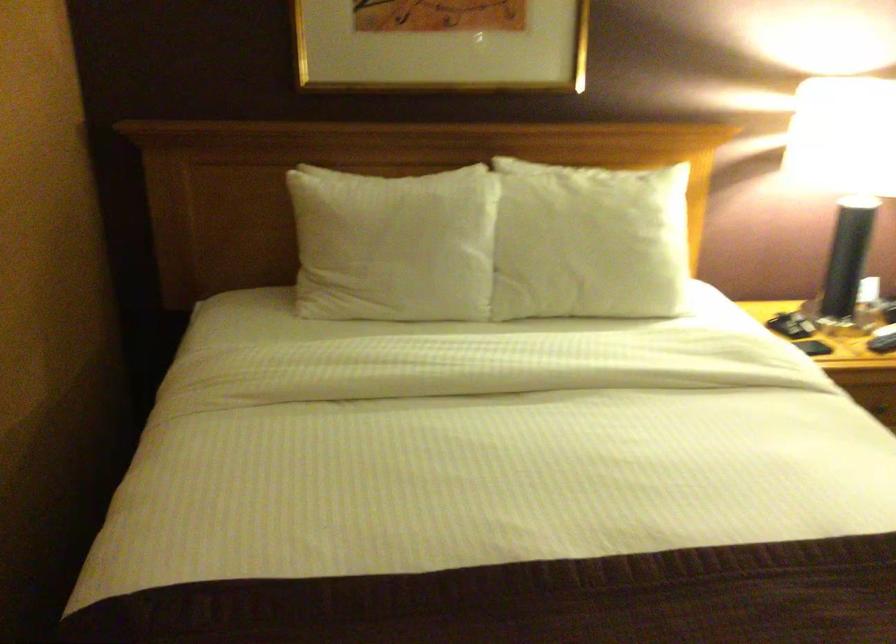
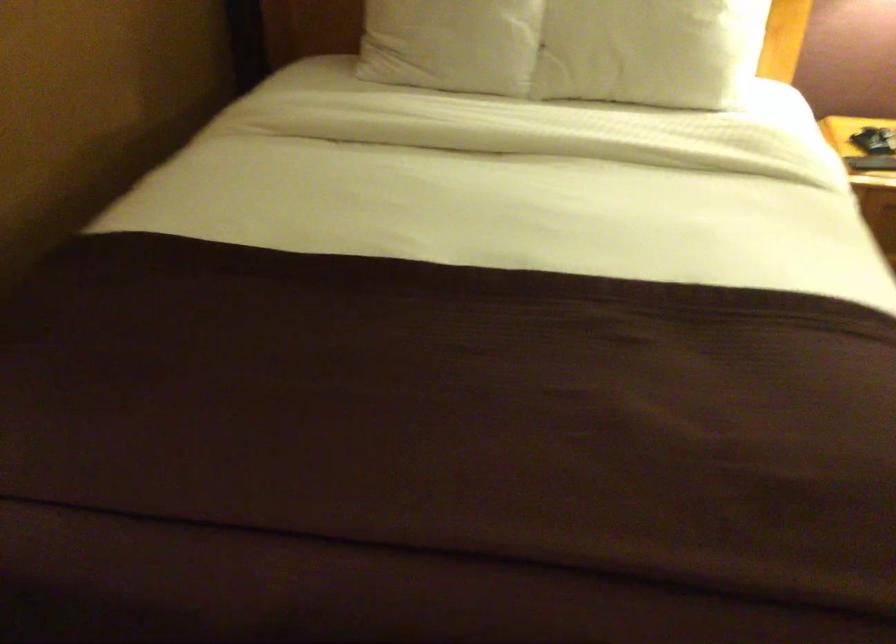
The point at [606,269] is marked in the first image. Where is the corresponding point in the second image?

(649, 51)